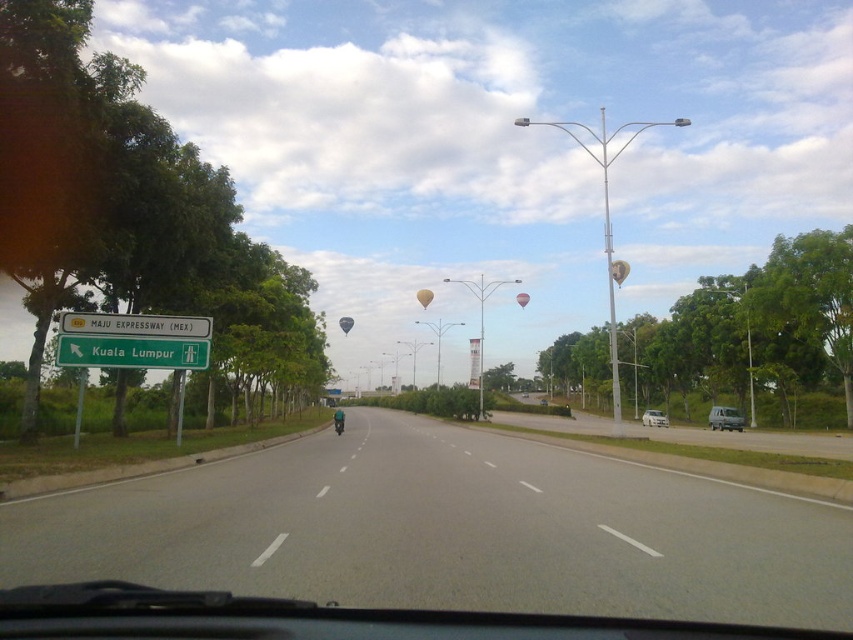
You are a driver approaching the green directional sign on the left side of the road. You need to reach the matte silver suv at right. Which direction should you turn to locate it?

The matte silver suv at right is located to the right side of the road, so you should turn right after passing the green directional sign on the left side of the road to locate it.

You are driving a car and see the green plastic signboard at left and the beige fabric balloon at center. Which object is closer to you?

The green plastic signboard at left is closer to you because it is in front of the beige fabric balloon at center.